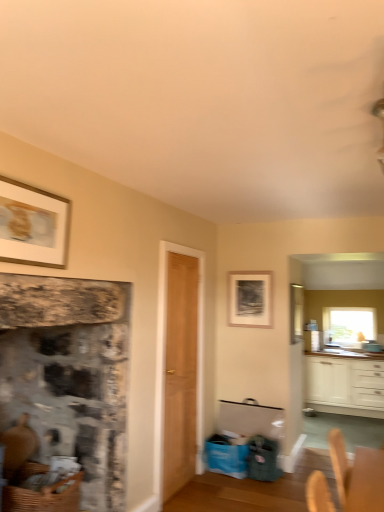
Question: Does light brown wood door at center have a lesser width compared to woven brown basket at lower left?

Choices:
 (A) yes
 (B) no

Answer: (A)

Question: From a real-world perspective, is light brown wood door at center located beneath woven brown basket at lower left?

Choices:
 (A) yes
 (B) no

Answer: (B)

Question: From the image's perspective, is light brown wood door at center on top of woven brown basket at lower left?

Choices:
 (A) yes
 (B) no

Answer: (A)

Question: Is light brown wood door at center positioned far away from woven brown basket at lower left?

Choices:
 (A) yes
 (B) no

Answer: (A)

Question: Is light brown wood door at center positioned beyond the bounds of woven brown basket at lower left?

Choices:
 (A) yes
 (B) no

Answer: (A)

Question: Considering the relative positions of light brown wood door at center and woven brown basket at lower left in the image provided, is light brown wood door at center to the left of woven brown basket at lower left from the viewer's perspective?

Choices:
 (A) no
 (B) yes

Answer: (A)

Question: Does woven brown basket at lower left have a larger size compared to gold-framed picture at upper left, the 2th picture frame positioned from the right?

Choices:
 (A) yes
 (B) no

Answer: (A)

Question: Can you confirm if woven brown basket at lower left is wider than gold-framed picture at upper left, which ranks as the 1th picture frame in left-to-right order?

Choices:
 (A) yes
 (B) no

Answer: (A)

Question: Is woven brown basket at lower left further to the viewer compared to gold-framed picture at upper left, which ranks as the second picture frame in back-to-front order?

Choices:
 (A) no
 (B) yes

Answer: (B)

Question: From the image's perspective, is woven brown basket at lower left above gold-framed picture at upper left, which ranks as the second picture frame in bottom-to-top order?

Choices:
 (A) no
 (B) yes

Answer: (A)

Question: Considering the relative sizes of woven brown basket at lower left and gold-framed picture at upper left, which ranks as the 1th picture frame in left-to-right order, in the image provided, is woven brown basket at lower left taller than gold-framed picture at upper left, which ranks as the 1th picture frame in left-to-right order,?

Choices:
 (A) no
 (B) yes

Answer: (A)

Question: Does woven brown basket at lower left have a lesser height compared to gold-framed picture at upper left, which ranks as the second picture frame in bottom-to-top order?

Choices:
 (A) no
 (B) yes

Answer: (B)

Question: Is clear glass window at upper right oriented away from light brown wood door at center?

Choices:
 (A) no
 (B) yes

Answer: (A)